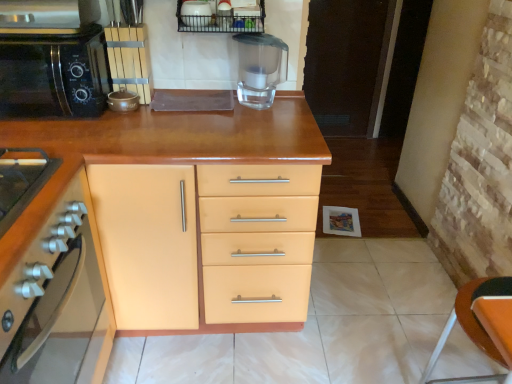
The width and height of the screenshot is (512, 384). In order to click on vacant space to the right of matte wood cabinet at center, which is the 1th cabinetry in back-to-front order in this screenshot , I will do `click(360, 314)`.